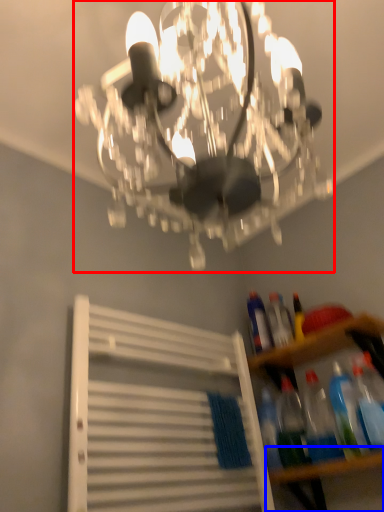
Question: Which point is closer to the camera, lamp (highlighted by a red box) or table (highlighted by a blue box)?

Choices:
 (A) lamp
 (B) table

Answer: (A)